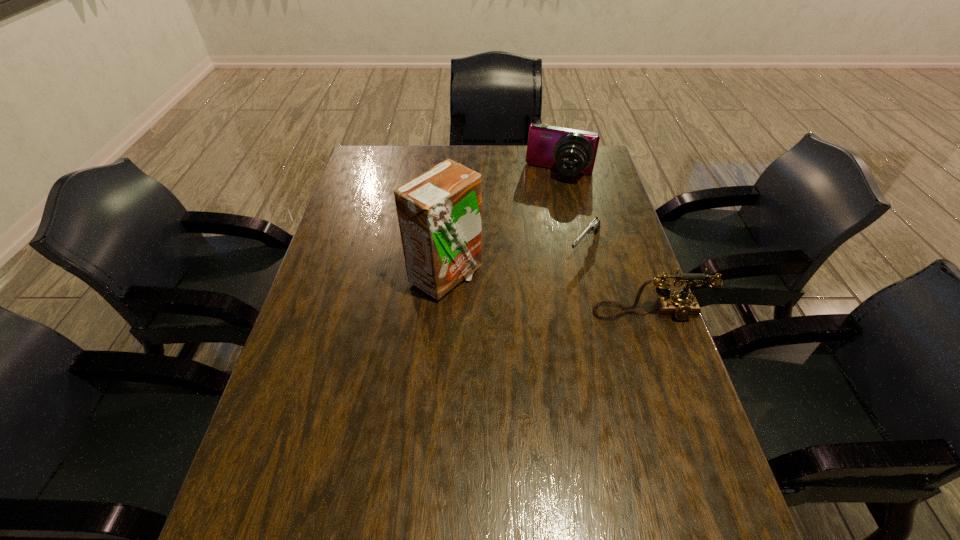
The image size is (960, 540). Identify the location of free space located on the front-facing side of the shortest object. (544, 297).

Identify the location of vacant point located on the front-facing side of the shortest object. (516, 330).

I want to click on vacant region located 0.070m on the front-facing side of the shortest object, so click(564, 274).

Find the location of a particular element. Image resolution: width=960 pixels, height=540 pixels. free region located at the narrow end of the pinecone is located at coordinates (482, 244).

The image size is (960, 540). I want to click on blank space located 0.220m at the narrow end of the pinecone, so [x=484, y=246].

The height and width of the screenshot is (540, 960). In order to click on vacant space located 0.200m at the narrow end of the pinecone in this screenshot , I will do `click(480, 242)`.

Where is `object situated at the far edge`? object situated at the far edge is located at coordinates (571, 151).

I want to click on telephone that is at the right edge, so click(682, 306).

You are a GUI agent. You are given a task and a screenshot of the screen. Output one action in this format:
    pyautogui.click(x=<x>, y=<y>)
    Task: Click on the camera that is at the right edge
    The image size is (960, 540).
    Given the screenshot: What is the action you would take?
    pyautogui.click(x=571, y=151)

Find the location of `pistol that is at the right edge`. pistol that is at the right edge is located at coordinates (594, 226).